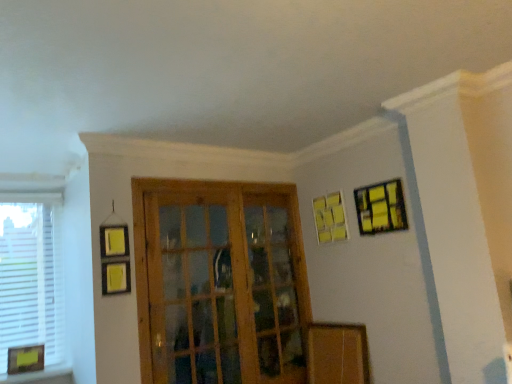
Locate an element on the screen. The width and height of the screenshot is (512, 384). yellow matte picture frame at upper right, the second picture frame when ordered from bottom to top is located at coordinates (330, 218).

Locate an element on the screen. yellow matte picture frame at lower left, the 1th picture frame positioned from the left is located at coordinates (25, 359).

In order to face yellow matte picture frame at lower left, the 1th picture frame positioned from the left, should I rotate leftwards or rightwards?

To face it directly, rotate left by 28.267 degrees.

What is the approximate height of yellow matte picture frame at upper right, the 1th picture frame viewed from the top?

14.48 inches.

This screenshot has width=512, height=384. What are the coordinates of `wooden screen door at center` in the screenshot? It's located at pyautogui.click(x=219, y=282).

Which point is more distant from viewer, (61, 347) or (326, 198)?

The point (326, 198) is farther.

Is white matte window at left bigger or smaller than yellow matte picture frame at upper right, the second picture frame when ordered from bottom to top?

Considering their sizes, white matte window at left takes up more space than yellow matte picture frame at upper right, the second picture frame when ordered from bottom to top.

Where is `picture frame behind the white matte window at left`? picture frame behind the white matte window at left is located at coordinates (330, 218).

From the image's perspective, is white matte window at left on top of yellow matte picture frame at upper right, arranged as the second picture frame when viewed from the right?

No.

From the image's perspective, is yellow matte picture frame at upper right, which ranks as the third picture frame in bottom-to-top order, on top of yellow matte picture frame at lower left, the 1th picture frame positioned from the left?

Yes.

Locate an element on the screen. The height and width of the screenshot is (384, 512). picture frame that is the 2nd object located below the yellow matte picture frame at upper right, the 1th picture frame viewed from the top (from the image's perspective) is located at coordinates (25, 359).

Does yellow matte picture frame at upper right, which is the third picture frame from left to right, have a greater width compared to yellow matte picture frame at lower left, the third picture frame from the right?

Incorrect, the width of yellow matte picture frame at upper right, which is the third picture frame from left to right, does not surpass that of yellow matte picture frame at lower left, the third picture frame from the right.

From a real-world perspective, which object stands above the other?

yellow matte picture frame at upper right, the 1th picture frame viewed from the top, from a real-world perspective.

Consider the image. Is yellow matte picture frame at upper right, arranged as the second picture frame when viewed from the right, facing towards yellow matte picture frame at lower left, the third picture frame from the right?

No.

From a real-world perspective, does yellow matte picture frame at upper right, acting as the 2th picture frame starting from the top, stand above yellow matte picture frame at lower left, arranged as the 1th picture frame when ordered from the bottom?

Yes.

Which picture frame is the 1st one when counting from the right side of the yellow matte picture frame at lower left, arranged as the 1th picture frame when ordered from the bottom? Please provide its 2D coordinates.

[(330, 218)]

From the image's perspective, does yellow matte picture frame at upper right, which ranks as the 2th picture frame in left-to-right order, appear higher than yellow matte picture frame at lower left, arranged as the 1th picture frame when ordered from the bottom?

Indeed, from the image's perspective, yellow matte picture frame at upper right, which ranks as the 2th picture frame in left-to-right order, is shown above yellow matte picture frame at lower left, arranged as the 1th picture frame when ordered from the bottom.

Considering the relative sizes of wooden screen door at center and white matte window at left in the image provided, is wooden screen door at center thinner than white matte window at left?

No, wooden screen door at center is not thinner than white matte window at left.

Is the depth of wooden screen door at center less than that of white matte window at left?

Yes, it is.

Would you say wooden screen door at center is a long distance from white matte window at left?

wooden screen door at center is far away from white matte window at left.

Is wooden screen door at center looking in the opposite direction of white matte window at left?

No, wooden screen door at center is not facing away from white matte window at left.

Is yellow matte picture frame at lower left, placed as the third picture frame when sorted from top to bottom, surrounding wooden screen door at center?

That's incorrect, wooden screen door at center is not inside yellow matte picture frame at lower left, placed as the third picture frame when sorted from top to bottom.

The width and height of the screenshot is (512, 384). What are the coordinates of `the 2nd picture frame behind when counting from the wooden screen door at center` in the screenshot? It's located at [x=25, y=359].

How different are the orientations of yellow matte picture frame at lower left, the 1th picture frame positioned from the left, and wooden screen door at center in degrees?

The angular difference between yellow matte picture frame at lower left, the 1th picture frame positioned from the left, and wooden screen door at center is 9.13 degrees.

In terms of width, does yellow matte picture frame at lower left, arranged as the 1th picture frame when ordered from the bottom, look wider or thinner when compared to wooden screen door at center?

In the image, yellow matte picture frame at lower left, arranged as the 1th picture frame when ordered from the bottom, appears to be wider than wooden screen door at center.

From the picture: Is yellow matte picture frame at upper right, which is the third picture frame from left to right, not near yellow matte picture frame at upper right, arranged as the second picture frame when viewed from the right?

yellow matte picture frame at upper right, which is the third picture frame from left to right, is actually quite close to yellow matte picture frame at upper right, arranged as the second picture frame when viewed from the right.

Is yellow matte picture frame at upper right, which is the third picture frame from left to right, to the left or to the right of yellow matte picture frame at upper right, which ranks as the 2th picture frame in left-to-right order, in the image?

yellow matte picture frame at upper right, which is the third picture frame from left to right, is to the right of yellow matte picture frame at upper right, which ranks as the 2th picture frame in left-to-right order.

From the image's perspective, which one is positioned higher, yellow matte picture frame at upper right, which is counted as the first picture frame, starting from the right, or yellow matte picture frame at upper right, arranged as the second picture frame when viewed from the right?

From the image's view, yellow matte picture frame at upper right, which is counted as the first picture frame, starting from the right, is above.

Is there a large distance between white matte window at left and yellow matte picture frame at upper right, which is counted as the first picture frame, starting from the right?

Yes, white matte window at left is far from yellow matte picture frame at upper right, which is counted as the first picture frame, starting from the right.

From the picture: From the image's perspective, which is above, white matte window at left or yellow matte picture frame at upper right, which is the third picture frame from left to right?

yellow matte picture frame at upper right, which is the third picture frame from left to right, from the image's perspective.

Is white matte window at left facing towards yellow matte picture frame at upper right, the 1th picture frame viewed from the top?

No, white matte window at left is not aimed at yellow matte picture frame at upper right, the 1th picture frame viewed from the top.

Image resolution: width=512 pixels, height=384 pixels. Find the location of `window below the yellow matte picture frame at upper right, acting as the 2th picture frame starting from the top (from the image's perspective)`. window below the yellow matte picture frame at upper right, acting as the 2th picture frame starting from the top (from the image's perspective) is located at coordinates (31, 275).

I want to click on the 2nd picture frame to the right of the yellow matte picture frame at lower left, arranged as the 1th picture frame when ordered from the bottom, counting from the anchor's position, so click(x=381, y=208).

When comparing their distances from yellow matte picture frame at upper right, the 1th picture frame viewed from the top, does yellow matte picture frame at upper right, which ranks as the 2th picture frame in left-to-right order, or wooden screen door at center seem closer?

Based on the image, yellow matte picture frame at upper right, which ranks as the 2th picture frame in left-to-right order, appears to be nearer to yellow matte picture frame at upper right, the 1th picture frame viewed from the top.

Estimate the real-world distances between objects in this image. Which object is closer to yellow matte picture frame at lower left, placed as the third picture frame when sorted from top to bottom, yellow matte picture frame at upper right, arranged as the second picture frame when viewed from the right, or white matte window at left?

The object closer to yellow matte picture frame at lower left, placed as the third picture frame when sorted from top to bottom, is white matte window at left.

Estimate the real-world distances between objects in this image. Which object is further from white matte window at left, wooden screen door at center or yellow matte picture frame at upper right, the second picture frame when ordered from bottom to top?

The object further to white matte window at left is yellow matte picture frame at upper right, the second picture frame when ordered from bottom to top.

Based on their spatial positions, is wooden screen door at center or yellow matte picture frame at upper right, acting as the 2th picture frame starting from the top, closer to yellow matte picture frame at lower left, arranged as the 1th picture frame when ordered from the bottom?

wooden screen door at center.

Based on their spatial positions, is yellow matte picture frame at upper right, which ranks as the third picture frame in bottom-to-top order, or yellow matte picture frame at lower left, the 1th picture frame positioned from the left, further from yellow matte picture frame at upper right, acting as the 2th picture frame starting from the top?

The object further to yellow matte picture frame at upper right, acting as the 2th picture frame starting from the top, is yellow matte picture frame at lower left, the 1th picture frame positioned from the left.

Which object lies further to the anchor point yellow matte picture frame at lower left, the 1th picture frame positioned from the left, yellow matte picture frame at upper right, acting as the 2th picture frame starting from the top, or yellow matte picture frame at upper right, which is counted as the first picture frame, starting from the right?

Based on the image, yellow matte picture frame at upper right, which is counted as the first picture frame, starting from the right, appears to be further to yellow matte picture frame at lower left, the 1th picture frame positioned from the left.

Estimate the real-world distances between objects in this image. Which object is further from yellow matte picture frame at lower left, placed as the third picture frame when sorted from top to bottom, white matte window at left or wooden screen door at center?

The object further to yellow matte picture frame at lower left, placed as the third picture frame when sorted from top to bottom, is wooden screen door at center.

From the image, which object appears to be nearer to yellow matte picture frame at lower left, the third picture frame from the right, wooden screen door at center or yellow matte picture frame at upper right, which is counted as the first picture frame, starting from the right?

The object closer to yellow matte picture frame at lower left, the third picture frame from the right, is wooden screen door at center.

At what (x,y) coordinates should I click in order to perform the action: click on screen door situated between yellow matte picture frame at lower left, the third picture frame from the right, and yellow matte picture frame at upper right, which is the third picture frame from left to right, from left to right. Please return your answer as a coordinate pair (x, y). The width and height of the screenshot is (512, 384). Looking at the image, I should click on pos(219,282).

Find the location of a particular element. This screenshot has height=384, width=512. picture frame between wooden screen door at center and yellow matte picture frame at upper right, which is the third picture frame from left to right is located at coordinates (330, 218).

This screenshot has height=384, width=512. What are the coordinates of `screen door between white matte window at left and yellow matte picture frame at upper right, the 1th picture frame viewed from the top` in the screenshot? It's located at (219, 282).

The height and width of the screenshot is (384, 512). I want to click on picture frame located between white matte window at left and yellow matte picture frame at upper right, the second picture frame when ordered from bottom to top, in the left-right direction, so click(x=25, y=359).